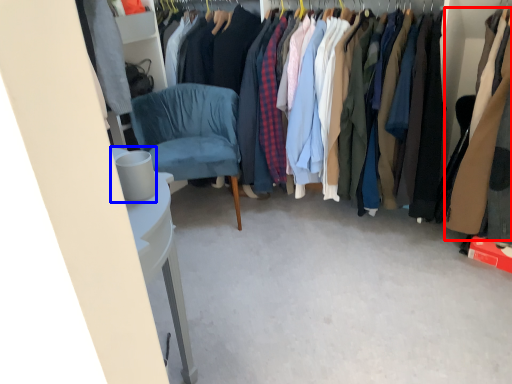
Question: Which point is closer to the camera, clothing (highlighted by a red box) or trash bin/can (highlighted by a blue box)?

Choices:
 (A) clothing
 (B) trash bin/can

Answer: (B)